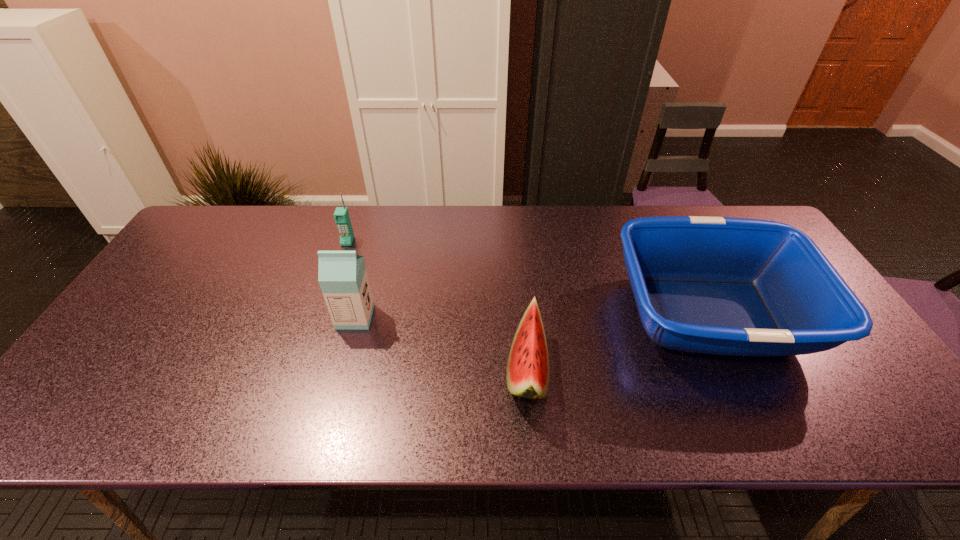
At what (x,y) coordinates should I click in order to perform the action: click on the second object from left to right. Please return your answer as a coordinate pair (x, y). This screenshot has width=960, height=540. Looking at the image, I should click on (342, 276).

The height and width of the screenshot is (540, 960). Find the location of `the tallest object`. the tallest object is located at coordinates (342, 276).

What are the coordinates of `the farthest object` in the screenshot? It's located at (341, 215).

Identify the location of cellular telephone. The image size is (960, 540). pyautogui.click(x=341, y=215).

What are the coordinates of `the rightmost object` in the screenshot? It's located at (730, 286).

Locate an element on the screen. The image size is (960, 540). the third object from left to right is located at coordinates (528, 374).

This screenshot has height=540, width=960. I want to click on free space located 0.310m on the back of the second object from left to right, so click(377, 233).

Identify the location of blank area located on the keypad of the farthest object. The height and width of the screenshot is (540, 960). (324, 314).

Locate an element on the screen. This screenshot has height=540, width=960. blank space located on the left of the tray is located at coordinates (589, 314).

The width and height of the screenshot is (960, 540). Identify the location of blank space located 0.220m on the outer rind of the third object from left to right. (413, 371).